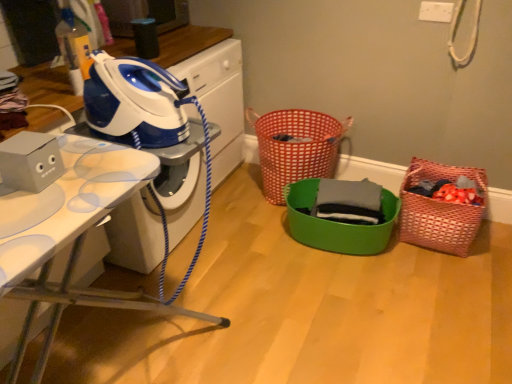
Question: Considering the relative sizes of green plastic basket at center, which is the 2th basket from right to left, and blue/white plastic iron at upper left, positioned as the 1th appliance in back-to-front order, in the image provided, is green plastic basket at center, which is the 2th basket from right to left, wider than blue/white plastic iron at upper left, positioned as the 1th appliance in back-to-front order,?

Choices:
 (A) yes
 (B) no

Answer: (A)

Question: Is green plastic basket at center, marked as the 2th basket in a left-to-right arrangement, not near blue/white plastic iron at upper left, which appears as the 2th appliance when ordered from the bottom?

Choices:
 (A) yes
 (B) no

Answer: (A)

Question: From the image's perspective, does green plastic basket at center, marked as the 2th basket in a left-to-right arrangement, appear lower than blue/white plastic iron at upper left, which appears as the first appliance when viewed from the top?

Choices:
 (A) no
 (B) yes

Answer: (B)

Question: Is green plastic basket at center, which is the 2th basket from right to left, closer to the viewer compared to blue/white plastic iron at upper left, which appears as the 2th appliance when ordered from the bottom?

Choices:
 (A) no
 (B) yes

Answer: (A)

Question: Is green plastic basket at center, which is the 2th basket from right to left, bigger than blue/white plastic iron at upper left, positioned as the 1th appliance in back-to-front order?

Choices:
 (A) no
 (B) yes

Answer: (B)

Question: In terms of size, does white glossy ironing board at left appear bigger or smaller than woven pink basket at right, the third basket viewed from the left?

Choices:
 (A) big
 (B) small

Answer: (A)

Question: Is white glossy ironing board at left spatially inside woven pink basket at right, the third basket viewed from the left, or outside of it?

Choices:
 (A) inside
 (B) outside

Answer: (B)

Question: From the image's perspective, is white glossy ironing board at left located above or below woven pink basket at right, the third basket viewed from the left?

Choices:
 (A) above
 (B) below

Answer: (A)

Question: From a real-world perspective, is white glossy ironing board at left positioned above or below woven pink basket at right, the third basket viewed from the left?

Choices:
 (A) below
 (B) above

Answer: (B)

Question: From the image's perspective, is green plastic basket at center, marked as the 2th basket in a left-to-right arrangement, positioned above or below gray matte cardboard box at left, the 1th appliance when ordered from front to back?

Choices:
 (A) above
 (B) below

Answer: (B)

Question: Considering the relative positions of green plastic basket at center, which is the 2th basket from right to left, and gray matte cardboard box at left, the 1th appliance when ordered from front to back, in the image provided, is green plastic basket at center, which is the 2th basket from right to left, to the left or to the right of gray matte cardboard box at left, the 1th appliance when ordered from front to back,?

Choices:
 (A) left
 (B) right

Answer: (B)

Question: Considering their positions, is green plastic basket at center, marked as the 2th basket in a left-to-right arrangement, located in front of or behind gray matte cardboard box at left, the 2th appliance in the back-to-front sequence?

Choices:
 (A) front
 (B) behind

Answer: (B)

Question: Is green plastic basket at center, marked as the 2th basket in a left-to-right arrangement, taller or shorter than gray matte cardboard box at left, the 1th appliance when ordered from front to back?

Choices:
 (A) short
 (B) tall

Answer: (B)

Question: Visually, is red woven basket at center, the first basket in the left-to-right sequence, positioned to the left or to the right of gray cotton shirt at center?

Choices:
 (A) left
 (B) right

Answer: (A)

Question: From their relative heights in the image, would you say red woven basket at center, the third basket positioned from the right, is taller or shorter than gray cotton shirt at center?

Choices:
 (A) tall
 (B) short

Answer: (A)